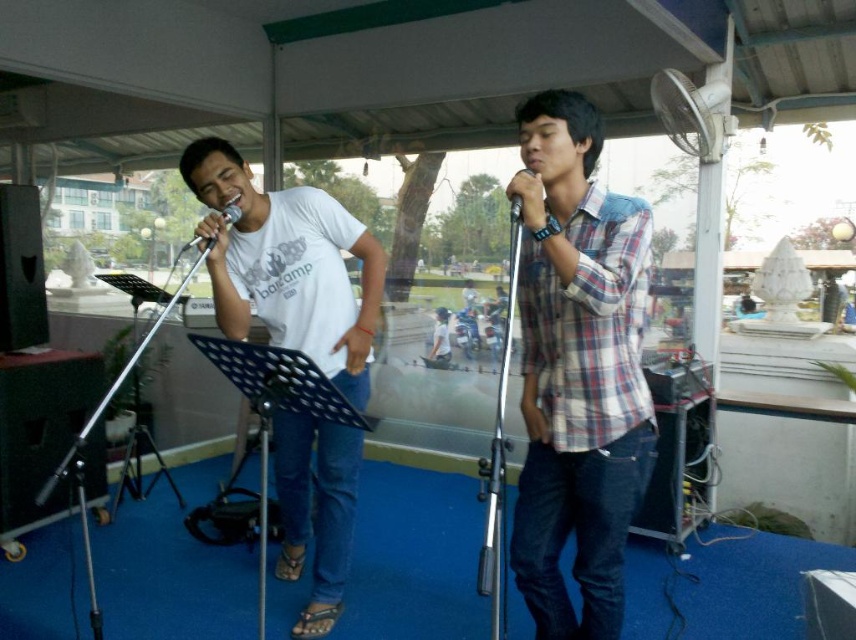
Does plaid cotton shirt at center have a lesser width compared to white matte t-shirt at center?

Indeed, plaid cotton shirt at center has a lesser width compared to white matte t-shirt at center.

Is plaid cotton shirt at center below white matte t-shirt at center?

Actually, plaid cotton shirt at center is above white matte t-shirt at center.

Which is in front, point (557, 550) or point (260, 317)?

Positioned in front is point (557, 550).

Locate an element on the screen. plaid cotton shirt at center is located at coordinates (577, 369).

Which is above, plaid cotton shirt at center or matte silver microphone at center?

matte silver microphone at center is higher up.

Does point (590, 445) lie behind point (191, 244)?

That is False.

Which is in front, point (565, 227) or point (200, 237)?

Point (565, 227) is in front.

Locate an element on the screen. plaid cotton shirt at center is located at coordinates (577, 369).

What do you see at coordinates (577, 369) in the screenshot? I see `plaid cotton shirt at center` at bounding box center [577, 369].

Does plaid cotton shirt at center have a lesser height compared to black matte microphone at center?

Incorrect, plaid cotton shirt at center's height does not fall short of black matte microphone at center's.

Describe the element at coordinates (577, 369) in the screenshot. I see `plaid cotton shirt at center` at that location.

At what (x,y) coordinates should I click in order to perform the action: click on plaid cotton shirt at center. Please return your answer as a coordinate pair (x, y). The image size is (856, 640). Looking at the image, I should click on (577, 369).